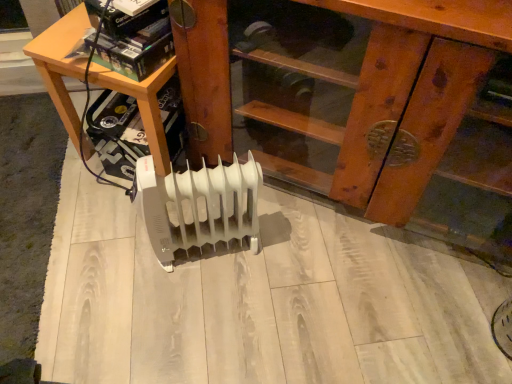
Question: Does white plastic heater at center have a greater width compared to white plastic heater at center?

Choices:
 (A) no
 (B) yes

Answer: (A)

Question: Is white plastic heater at center a part of white plastic heater at center?

Choices:
 (A) no
 (B) yes

Answer: (A)

Question: From a real-world perspective, does white plastic heater at center stand above white plastic heater at center?

Choices:
 (A) yes
 (B) no

Answer: (B)

Question: Is white plastic heater at center at the left side of white plastic heater at center?

Choices:
 (A) yes
 (B) no

Answer: (A)

Question: From the image's perspective, is white plastic heater at center located beneath white plastic heater at center?

Choices:
 (A) no
 (B) yes

Answer: (B)

Question: Considering the relative sizes of white plastic heater at center and white plastic heater at center in the image provided, is white plastic heater at center bigger than white plastic heater at center?

Choices:
 (A) no
 (B) yes

Answer: (A)

Question: From a real-world perspective, is white plastic heater at center physically below wooden at left?

Choices:
 (A) no
 (B) yes

Answer: (B)

Question: From the image's perspective, is white plastic heater at center above wooden at left?

Choices:
 (A) yes
 (B) no

Answer: (B)

Question: Considering the relative sizes of white plastic heater at center and wooden at left in the image provided, is white plastic heater at center bigger than wooden at left?

Choices:
 (A) no
 (B) yes

Answer: (A)

Question: Is white plastic heater at center smaller than wooden at left?

Choices:
 (A) no
 (B) yes

Answer: (B)

Question: Is white plastic heater at center shorter than wooden at left?

Choices:
 (A) no
 (B) yes

Answer: (B)

Question: Is white plastic heater at center placed right next to wooden at left?

Choices:
 (A) no
 (B) yes

Answer: (A)

Question: Is wooden at left surrounding white plastic heater at center?

Choices:
 (A) no
 (B) yes

Answer: (A)